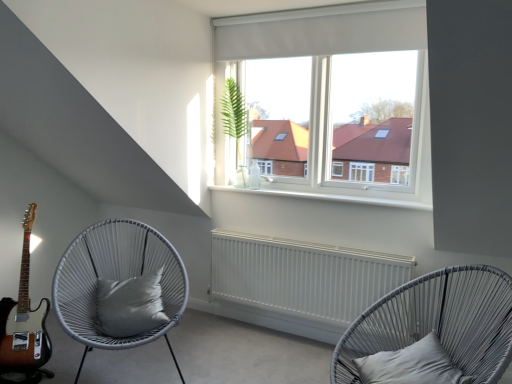
Locate an element on the screen. vacant location below white matte radiator at center (from a real-world perspective) is located at coordinates (275, 323).